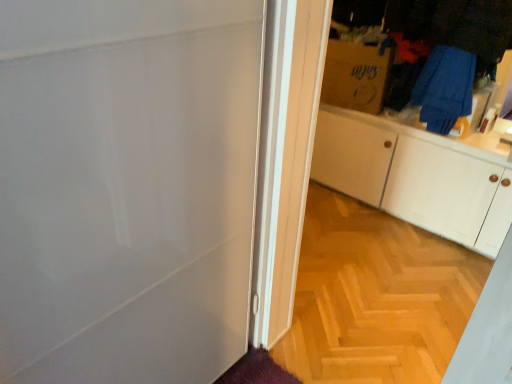
The width and height of the screenshot is (512, 384). I want to click on blank space situated above wooden floor at center (from a real-world perspective), so click(367, 274).